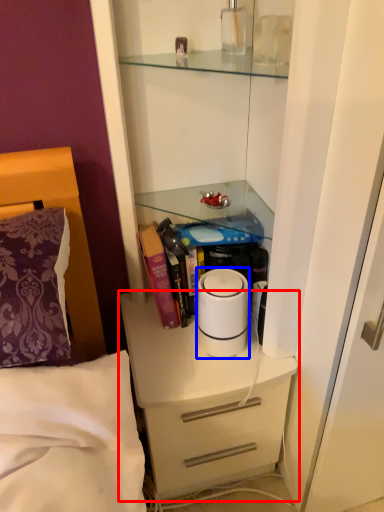
Question: Among these objects, which one is nearest to the camera, chest of drawers (highlighted by a red box) or home appliance (highlighted by a blue box)?

Choices:
 (A) chest of drawers
 (B) home appliance

Answer: (B)